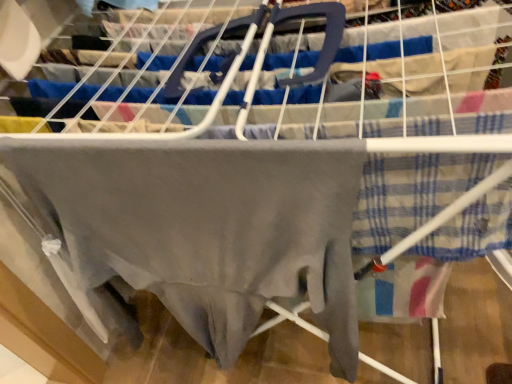
Locate an element on the screen. The image size is (512, 384). gray cotton sheet at center is located at coordinates (207, 227).

What do you see at coordinates (207, 227) in the screenshot? I see `gray cotton sheet at center` at bounding box center [207, 227].

Where is `gray cotton sheet at center`? The height and width of the screenshot is (384, 512). gray cotton sheet at center is located at coordinates (207, 227).